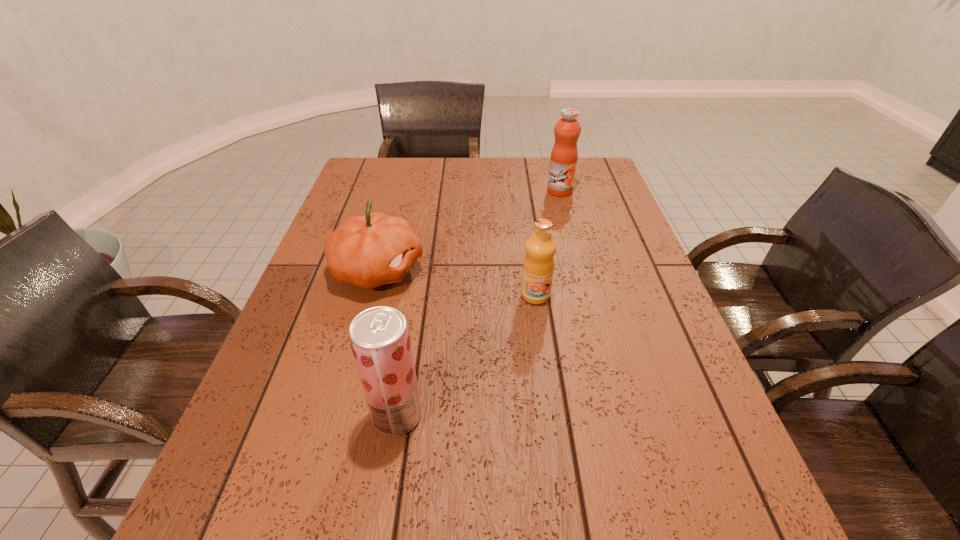
This screenshot has height=540, width=960. In order to click on the farthest fruit juice in this screenshot , I will do `click(563, 162)`.

Locate an element on the screen. This screenshot has height=540, width=960. the rightmost fruit juice is located at coordinates (563, 162).

Where is `the leftmost fruit juice`? the leftmost fruit juice is located at coordinates (379, 337).

Find the location of `the nearest object`. the nearest object is located at coordinates (379, 337).

At what (x,y) coordinates should I click in order to perform the action: click on the second farthest fruit juice. Please return your answer as a coordinate pair (x, y). Looking at the image, I should click on (538, 266).

At what (x,y) coordinates should I click in order to perform the action: click on the second fruit juice from left to right. Please return your answer as a coordinate pair (x, y). Looking at the image, I should click on click(538, 266).

Image resolution: width=960 pixels, height=540 pixels. Identify the location of pumpkin. (368, 251).

Where is `vacant space located 0.150m on the front label of the rightmost fruit juice`? The height and width of the screenshot is (540, 960). vacant space located 0.150m on the front label of the rightmost fruit juice is located at coordinates (568, 224).

This screenshot has width=960, height=540. Find the location of `vacant space positioned 0.120m on the right of the leftmost fruit juice`. vacant space positioned 0.120m on the right of the leftmost fruit juice is located at coordinates (487, 415).

This screenshot has width=960, height=540. What are the coordinates of `vacant space located 0.180m on the front label of the second fruit juice from left to right` in the screenshot? It's located at (545, 368).